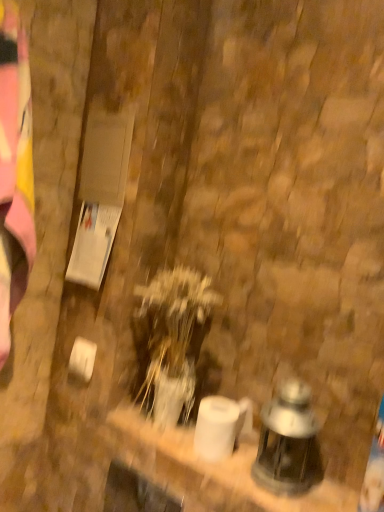
Question: Considering the positions of matte glass lantern at lower right and translucent glass vase at center in the image, is matte glass lantern at lower right taller or shorter than translucent glass vase at center?

Choices:
 (A) short
 (B) tall

Answer: (A)

Question: Is matte glass lantern at lower right situated inside translucent glass vase at center or outside?

Choices:
 (A) outside
 (B) inside

Answer: (A)

Question: Is point (296, 435) closer or farther from the camera than point (180, 322)?

Choices:
 (A) farther
 (B) closer

Answer: (B)

Question: In the image, is translucent glass vase at center positioned in front of or behind matte glass lantern at lower right?

Choices:
 (A) front
 (B) behind

Answer: (B)

Question: In terms of height, does translucent glass vase at center look taller or shorter compared to matte glass lantern at lower right?

Choices:
 (A) short
 (B) tall

Answer: (B)

Question: In the image, is translucent glass vase at center on the left side or the right side of matte glass lantern at lower right?

Choices:
 (A) left
 (B) right

Answer: (A)

Question: Is point (201, 292) closer or farther from the camera than point (279, 408)?

Choices:
 (A) closer
 (B) farther

Answer: (B)